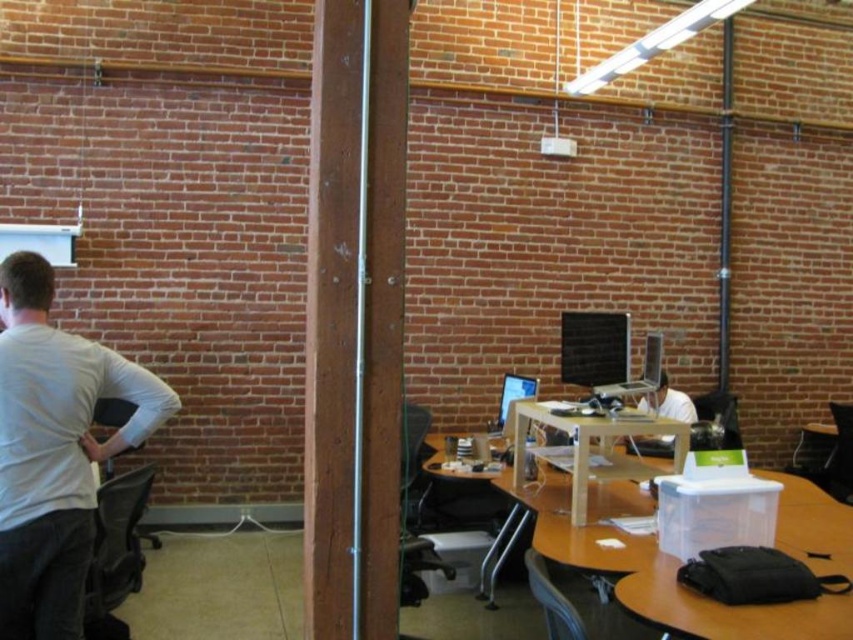
Between point (97, 577) and point (618, 634), which one is positioned in front?

Point (97, 577) is in front.

Which is below, black mesh office chair at left or gray fabric chair at lower right?

gray fabric chair at lower right

Locate an element on the screen. The width and height of the screenshot is (853, 640). black mesh office chair at left is located at coordinates (115, 552).

Find the location of a particular element. black mesh office chair at left is located at coordinates (115, 552).

Is point (770, 621) positioned behind point (595, 394)?

No, it is in front of (595, 394).

Which is below, light brown wooden table at lower right or silver metallic laptop at center?

Positioned lower is light brown wooden table at lower right.

Does point (625, 509) come behind point (595, 385)?

No, (625, 509) is in front of (595, 385).

Identify the location of light brown wooden table at lower right. (663, 572).

Can you confirm if light brown wooden table at lower right is thinner than matte black chair at center?

Incorrect, light brown wooden table at lower right's width is not less than matte black chair at center's.

Does light brown wooden table at lower right appear on the left side of matte black chair at center?

No, light brown wooden table at lower right is not to the left of matte black chair at center.

In the scene shown: Who is more forward, (x=730, y=628) or (x=401, y=422)?

Point (x=730, y=628) is in front.

At what (x,y) coordinates should I click in order to perform the action: click on light brown wooden table at lower right. Please return your answer as a coordinate pair (x, y). The height and width of the screenshot is (640, 853). Looking at the image, I should click on (663, 572).